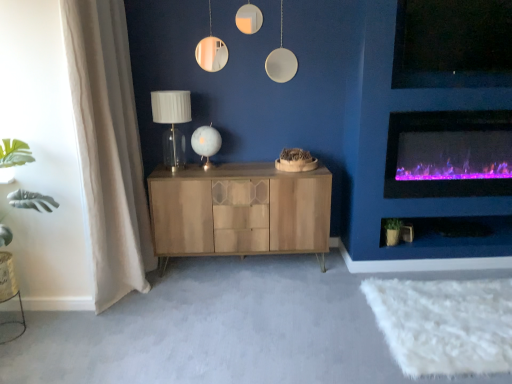
Where is `beige fabric curtain at left`? The width and height of the screenshot is (512, 384). beige fabric curtain at left is located at coordinates (108, 147).

You are a GUI agent. You are given a task and a screenshot of the screen. Output one action in this format:
    pyautogui.click(x=<x>, y=<y>)
    Task: Click on the wooden cabinet at center
    
    Given the screenshot: What is the action you would take?
    pyautogui.click(x=239, y=210)

What do you see at coordinates (448, 153) in the screenshot? I see `purple electric fireplace at right` at bounding box center [448, 153].

Where is `purple electric fireplace at right`? purple electric fireplace at right is located at coordinates (448, 153).

At what (x,y) coordinates should I click in order to perform the action: click on matte white glass table lamp at center, marked as the 1th table lamp in a left-to-right arrangement. Please return your answer as a coordinate pair (x, y). The image size is (512, 384). Looking at the image, I should click on (172, 123).

The image size is (512, 384). I want to click on beige fabric curtain at left, so click(x=108, y=147).

Based on the photo, which is correct: green matte plant at lower right is inside wooden cabinet at center, or outside of it?

green matte plant at lower right exists outside the volume of wooden cabinet at center.

From a real-world perspective, is green matte plant at lower right on wooden cabinet at center?

No.

Is green matte plant at lower right wider than wooden cabinet at center?

In fact, green matte plant at lower right might be narrower than wooden cabinet at center.

Is point (400, 221) behind point (302, 229)?

That is True.

Does point (180, 156) lie behind point (96, 153)?

Yes.

From the beige fabric curtain at left, count 1st table lamps backward and point to it. Please provide its 2D coordinates.

[(172, 123)]

Is matte white glass table lamp at center, placed as the 2th table lamp when sorted from right to left, shorter than beige fabric curtain at left?

Yes.

Is matte white glass table lamp at center, marked as the 1th table lamp in a left-to-right arrangement, oriented away from beige fabric curtain at left?

No.

Is purple electric fireplace at right inside or outside of matte white glass table lamp at center, marked as the 1th table lamp in a left-to-right arrangement?

purple electric fireplace at right lies outside matte white glass table lamp at center, marked as the 1th table lamp in a left-to-right arrangement.

Which is in front, purple electric fireplace at right or matte white glass table lamp at center, marked as the 1th table lamp in a left-to-right arrangement?

Positioned in front is matte white glass table lamp at center, marked as the 1th table lamp in a left-to-right arrangement.

This screenshot has height=384, width=512. I want to click on table lamp located in front of the purple electric fireplace at right, so click(x=172, y=123).

From a real-world perspective, which is physically below, purple electric fireplace at right or matte white glass table lamp at center, placed as the 2th table lamp when sorted from right to left?

purple electric fireplace at right is physically lower.

Which is correct: beige fabric curtain at left is inside purple electric fireplace at right, or outside of it?

beige fabric curtain at left is not enclosed by purple electric fireplace at right.

How distant is beige fabric curtain at left from purple electric fireplace at right?

beige fabric curtain at left is 1.84 meters away from purple electric fireplace at right.

Which is closer to the camera, (108, 186) or (508, 121)?

The point (108, 186) is closer.

Is beige fabric curtain at left in front of or behind purple electric fireplace at right in the image?

Clearly, beige fabric curtain at left is in front of purple electric fireplace at right.

The height and width of the screenshot is (384, 512). What are the coordinates of `curtain on the left of white glass table lamp at center, positioned as the 1th table lamp in right-to-left order` in the screenshot? It's located at (108, 147).

From the image's perspective, between white glass table lamp at center, which is the 2th table lamp in left-to-right order, and beige fabric curtain at left, which one is located above?

white glass table lamp at center, which is the 2th table lamp in left-to-right order, appears higher in the image.

Considering the sizes of white glass table lamp at center, positioned as the 1th table lamp in right-to-left order, and beige fabric curtain at left in the image, is white glass table lamp at center, positioned as the 1th table lamp in right-to-left order, wider or thinner than beige fabric curtain at left?

Clearly, white glass table lamp at center, positioned as the 1th table lamp in right-to-left order, has less width compared to beige fabric curtain at left.

Consider the image. Does wooden cabinet at center touch white glass table lamp at center, which is the 2th table lamp in left-to-right order?

No, wooden cabinet at center is not next to white glass table lamp at center, which is the 2th table lamp in left-to-right order.

From a real-world perspective, is wooden cabinet at center below white glass table lamp at center, which is the 2th table lamp in left-to-right order?

Yes, from a real-world perspective, wooden cabinet at center is beneath white glass table lamp at center, which is the 2th table lamp in left-to-right order.

Based on the photo, from the image's perspective, is wooden cabinet at center over white glass table lamp at center, which is the 2th table lamp in left-to-right order?

Actually, wooden cabinet at center appears below white glass table lamp at center, which is the 2th table lamp in left-to-right order, in the image.

Is wooden cabinet at center surrounding white glass table lamp at center, positioned as the 1th table lamp in right-to-left order?

No.

Is green matte plant at lower right not inside purple electric fireplace at right?

Yes.

Can you tell me how much green matte plant at lower right and purple electric fireplace at right differ in facing direction?

2.89 degrees separate the facing orientations of green matte plant at lower right and purple electric fireplace at right.

Is point (395, 222) positioned after point (440, 161)?

Yes.

The height and width of the screenshot is (384, 512). Find the location of `plant below the purple electric fireplace at right (from a real-world perspective)`. plant below the purple electric fireplace at right (from a real-world perspective) is located at coordinates tap(392, 231).

The height and width of the screenshot is (384, 512). I want to click on cabinetry that is above the green matte plant at lower right (from the image's perspective), so click(239, 210).

At what (x,y) coordinates should I click in order to perform the action: click on table lamp above the beige fabric curtain at left (from a real-world perspective). Please return your answer as a coordinate pair (x, y). This screenshot has width=512, height=384. Looking at the image, I should click on (172, 123).

Looking at the image, which one is located closer to purple electric fireplace at right, wooden cabinet at center or beige fabric curtain at left?

wooden cabinet at center.

Looking at the image, which one is located further to beige fabric curtain at left, purple electric fireplace at right or green matte plant at lower right?

purple electric fireplace at right is positioned further to the anchor beige fabric curtain at left.

Considering their positions, is beige fabric curtain at left positioned further to purple electric fireplace at right than green matte plant at lower right?

Among the two, beige fabric curtain at left is located further to purple electric fireplace at right.

When comparing their distances from green matte plant at lower right, does matte white glass table lamp at center, placed as the 2th table lamp when sorted from right to left, or white glass table lamp at center, positioned as the 1th table lamp in right-to-left order, seem closer?

The object closer to green matte plant at lower right is white glass table lamp at center, positioned as the 1th table lamp in right-to-left order.

Considering their positions, is matte white glass table lamp at center, placed as the 2th table lamp when sorted from right to left, positioned closer to purple electric fireplace at right than green matte plant at lower right?

The object closer to purple electric fireplace at right is green matte plant at lower right.

When comparing their distances from matte white glass table lamp at center, placed as the 2th table lamp when sorted from right to left, does green matte plant at lower right or purple electric fireplace at right seem closer?

The object closer to matte white glass table lamp at center, placed as the 2th table lamp when sorted from right to left, is green matte plant at lower right.

Considering their positions, is white glass table lamp at center, positioned as the 1th table lamp in right-to-left order, positioned further to wooden cabinet at center than green matte plant at lower right?

The object further to wooden cabinet at center is green matte plant at lower right.

When comparing their distances from green matte plant at lower right, does purple electric fireplace at right or wooden cabinet at center seem closer?

Among the two, purple electric fireplace at right is located nearer to green matte plant at lower right.

You are a GUI agent. You are given a task and a screenshot of the screen. Output one action in this format:
    pyautogui.click(x=<x>, y=<y>)
    Task: Click on the cabinetry located between white glass table lamp at center, positioned as the 1th table lamp in right-to-left order, and purple electric fireplace at right in the left-right direction
    This screenshot has width=512, height=384.
    Given the screenshot: What is the action you would take?
    pyautogui.click(x=239, y=210)

The image size is (512, 384). In order to click on plant between white glass table lamp at center, which is the 2th table lamp in left-to-right order, and purple electric fireplace at right, in the horizontal direction in this screenshot , I will do `click(392, 231)`.

At what (x,y) coordinates should I click in order to perform the action: click on table lamp between matte white glass table lamp at center, marked as the 1th table lamp in a left-to-right arrangement, and purple electric fireplace at right, in the horizontal direction. Please return your answer as a coordinate pair (x, y). The image size is (512, 384). Looking at the image, I should click on (206, 143).

At what (x,y) coordinates should I click in order to perform the action: click on table lamp located between beige fabric curtain at left and white glass table lamp at center, positioned as the 1th table lamp in right-to-left order, in the depth direction. Please return your answer as a coordinate pair (x, y). This screenshot has height=384, width=512. Looking at the image, I should click on (172, 123).